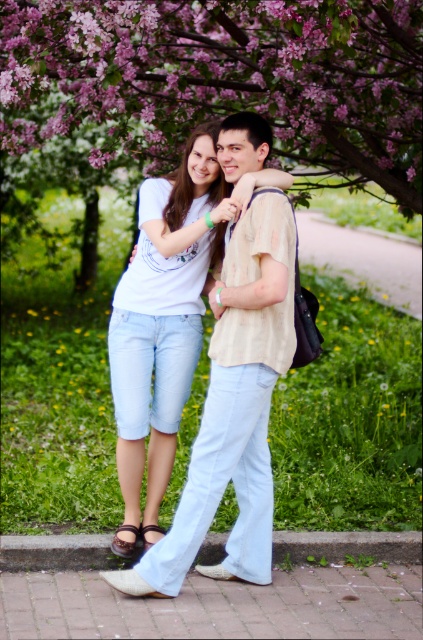
Does pink blossoms at upper center have a greater width compared to light blue denim shorts at center?

Correct, the width of pink blossoms at upper center exceeds that of light blue denim shorts at center.

Which is behind, point (301, 16) or point (252, 282)?

Point (301, 16)

Find the location of a particular element. The image size is (423, 640). pink blossoms at upper center is located at coordinates (225, 76).

Between light blue denim shorts at center and brick pavement at lower center, which one is positioned higher?

light blue denim shorts at center is above.

Locate an element on the screen. This screenshot has height=640, width=423. light blue denim shorts at center is located at coordinates (233, 412).

The height and width of the screenshot is (640, 423). What are the coordinates of `light blue denim shorts at center` in the screenshot? It's located at (233, 412).

Looking at this image, is pink blossoms at upper center to the right of brick pavement at lower center from the viewer's perspective?

Incorrect, pink blossoms at upper center is not on the right side of brick pavement at lower center.

Does pink blossoms at upper center lie in front of brick pavement at lower center?

That is False.

Which is behind, point (277, 122) or point (76, 598)?

Positioned behind is point (277, 122).

Image resolution: width=423 pixels, height=640 pixels. Find the location of `pink blossoms at upper center`. pink blossoms at upper center is located at coordinates (225, 76).